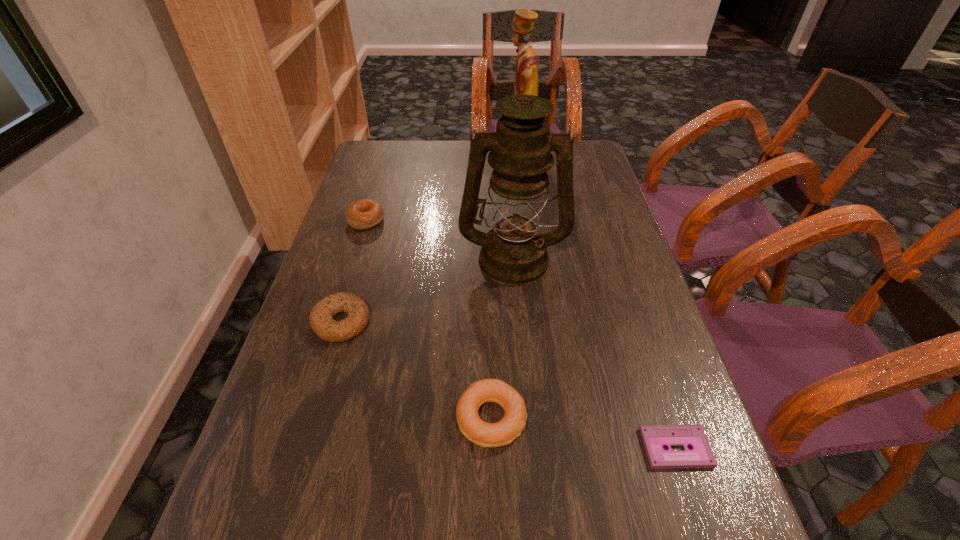
In order to click on free space between the videotape and the fifth nearest object in this screenshot , I will do `click(521, 334)`.

You are a GUI agent. You are given a task and a screenshot of the screen. Output one action in this format:
    pyautogui.click(x=<x>, y=<y>)
    Task: Click on the unoccupied area between the farthest bagel and the rightmost bagel
    
    Given the screenshot: What is the action you would take?
    pyautogui.click(x=429, y=320)

Image resolution: width=960 pixels, height=540 pixels. Find the location of `empty space that is in between the fourth farthest object and the nearest bagel`. empty space that is in between the fourth farthest object and the nearest bagel is located at coordinates (417, 370).

Where is `unoccupied position between the second farthest object and the third farthest object`? unoccupied position between the second farthest object and the third farthest object is located at coordinates (440, 240).

Where is `free space between the nutcracker and the second nearest bagel`? The image size is (960, 540). free space between the nutcracker and the second nearest bagel is located at coordinates pyautogui.click(x=431, y=243).

Locate an element on the screen. This screenshot has width=960, height=540. free space between the nutcracker and the nearest bagel is located at coordinates (506, 291).

Find the location of a particular element. free space between the nutcracker and the second farthest bagel is located at coordinates (431, 243).

This screenshot has height=540, width=960. Find the location of `vacant area that lies between the oil lamp and the second farthest bagel`. vacant area that lies between the oil lamp and the second farthest bagel is located at coordinates (427, 290).

Identify which object is the fifth nearest to the farthest object. Please provide its 2D coordinates. Your answer should be formatted as a tuple, i.e. [(x, y)], where the tuple contains the x and y coordinates of a point satisfying the conditions above.

[(655, 437)]

Find the location of a particular element. This screenshot has width=960, height=540. the fourth closest object relative to the oil lamp is located at coordinates (504, 432).